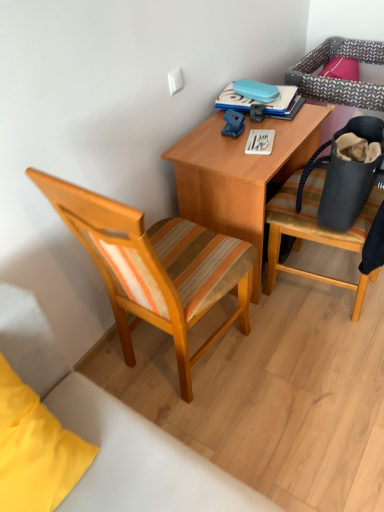
Locate an element on the screen. Image resolution: width=384 pixels, height=512 pixels. free region under woodenchair at left, the first chair positioned from the left (from a real-world perspective) is located at coordinates (193, 355).